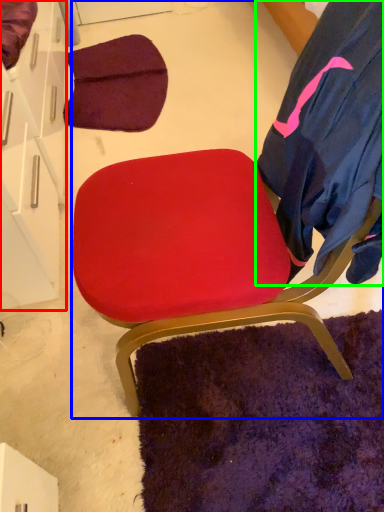
Question: Estimate the real-world distances between objects in this image. Which object is farther from drawer (highlighted by a red box), chair (highlighted by a blue box) or robe (highlighted by a green box)?

Choices:
 (A) chair
 (B) robe

Answer: (B)